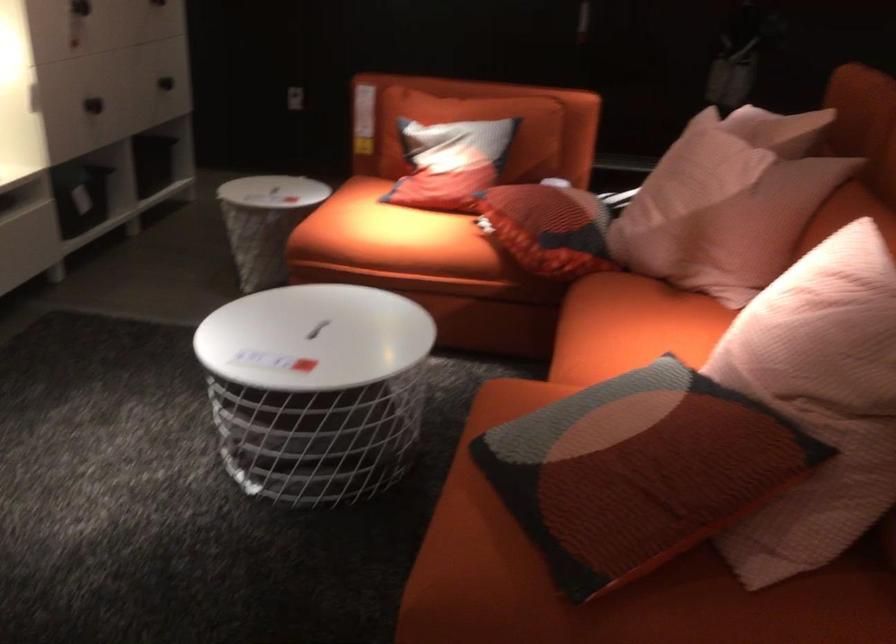
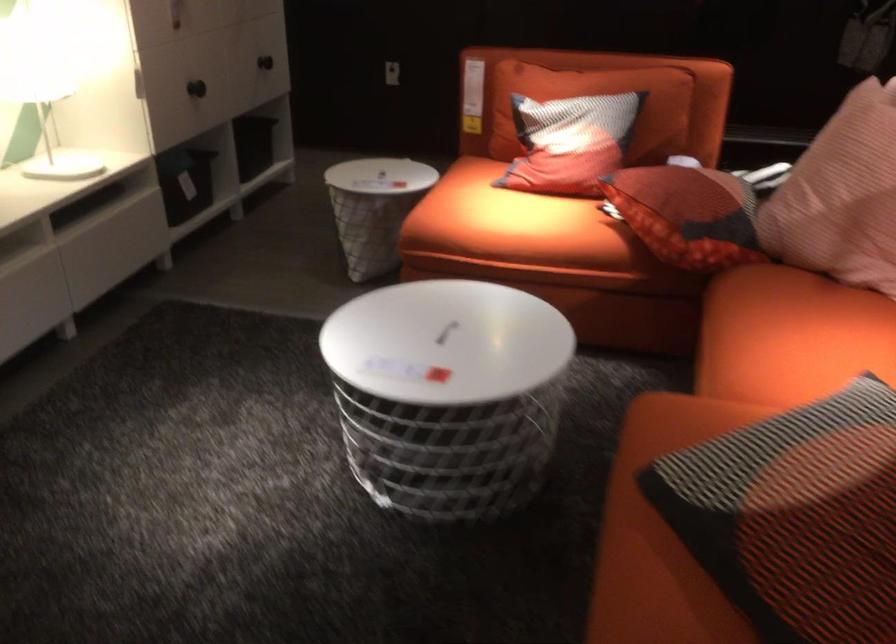
Question: Based on the continuous images, in which direction is the camera rotating? Reply with the corresponding letter.

Choices:
 (A) Left
 (B) Right
 (C) Up
 (D) Down

Answer: (A)